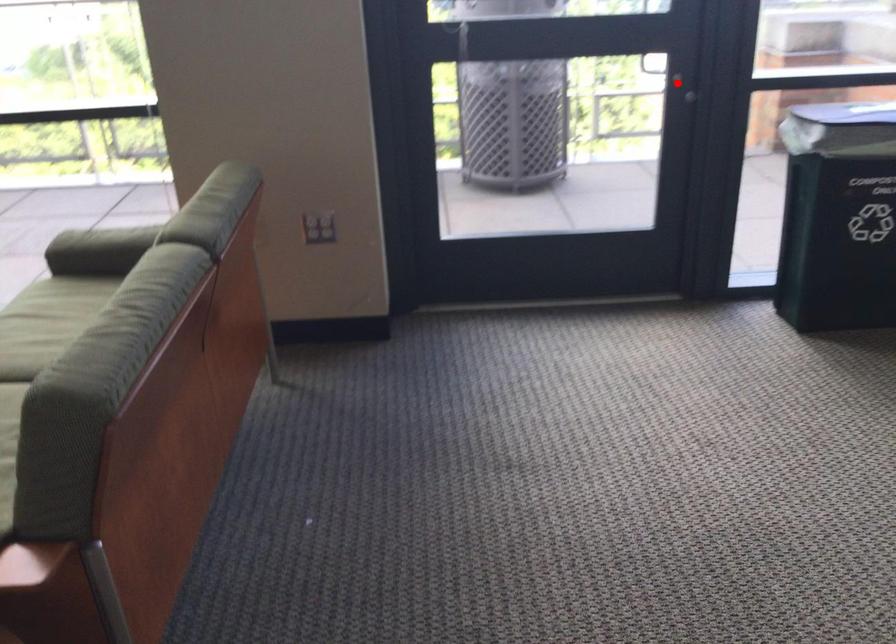
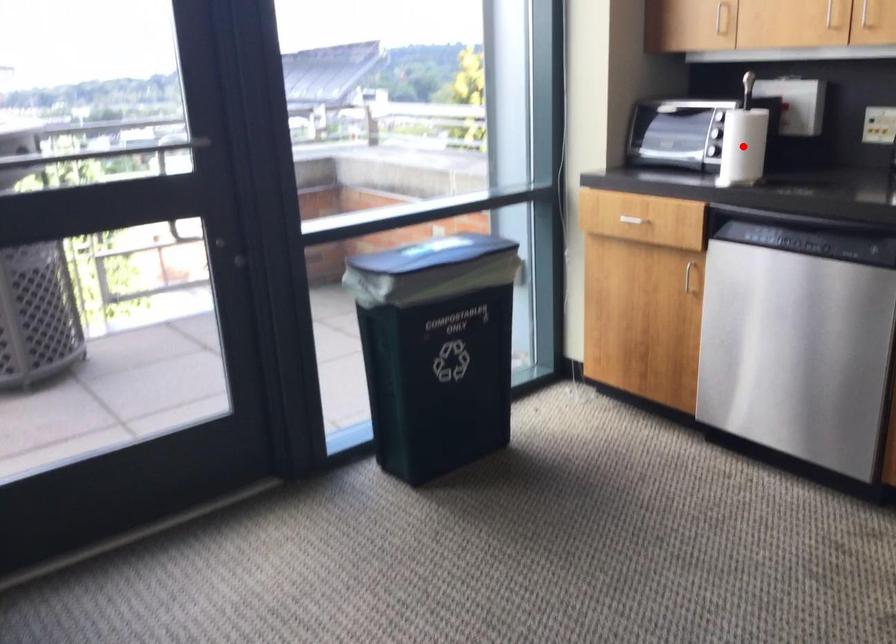
I am providing you with two images of the same scene from different viewpoints. A red point is marked on the first image and another point is marked on the second image. Is the marked point in image1 the same physical position as the marked point in image2?

No